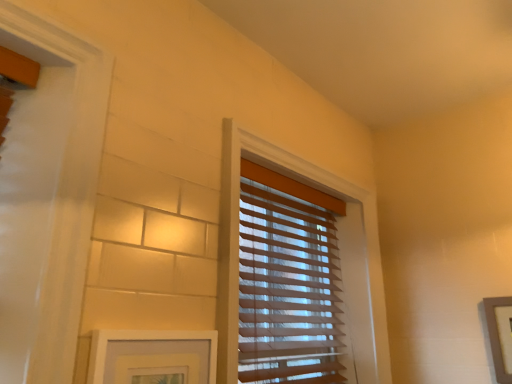
Question: Considering the relative sizes of wooden picture frame at right, which is counted as the second picture frame, starting from the left, and white matte picture frame at lower left, the 2th picture frame when ordered from back to front, in the image provided, is wooden picture frame at right, which is counted as the second picture frame, starting from the left, smaller than white matte picture frame at lower left, the 2th picture frame when ordered from back to front,?

Choices:
 (A) yes
 (B) no

Answer: (A)

Question: Is wooden picture frame at right, placed as the first picture frame when sorted from right to left, further to camera compared to white matte picture frame at lower left, the 2th picture frame viewed from the right?

Choices:
 (A) yes
 (B) no

Answer: (A)

Question: Can you confirm if wooden picture frame at right, placed as the first picture frame when sorted from right to left, is thinner than white matte picture frame at lower left, the first picture frame viewed from the front?

Choices:
 (A) yes
 (B) no

Answer: (A)

Question: Is wooden picture frame at right, which is counted as the second picture frame, starting from the left, outside of white matte picture frame at lower left, the 2th picture frame when ordered from back to front?

Choices:
 (A) no
 (B) yes

Answer: (B)

Question: Can you confirm if wooden picture frame at right, which is the 2th picture frame in front-to-back order, is bigger than white matte picture frame at lower left, the 2th picture frame when ordered from back to front?

Choices:
 (A) no
 (B) yes

Answer: (A)

Question: Would you say white matte picture frame at lower left, the first picture frame viewed from the front, is to the left or to the right of wooden picture frame at right, which is counted as the first picture frame, starting from the back, in the picture?

Choices:
 (A) right
 (B) left

Answer: (B)

Question: Choose the correct answer: Is white matte picture frame at lower left, which appears as the 1th picture frame when viewed from the left, inside wooden picture frame at right, placed as the first picture frame when sorted from right to left, or outside it?

Choices:
 (A) outside
 (B) inside

Answer: (A)

Question: From a real-world perspective, relative to wooden picture frame at right, which is counted as the second picture frame, starting from the left, is white matte picture frame at lower left, the first picture frame viewed from the front, vertically above or below?

Choices:
 (A) above
 (B) below

Answer: (B)

Question: Considering their positions, is white matte picture frame at lower left, the first picture frame viewed from the front, located in front of or behind wooden picture frame at right, which is counted as the first picture frame, starting from the back?

Choices:
 (A) behind
 (B) front

Answer: (B)

Question: Based on their positions, is translucent wood blinds at center located to the left or right of wooden picture frame at right, which is counted as the first picture frame, starting from the back?

Choices:
 (A) left
 (B) right

Answer: (A)

Question: Is point (335, 367) closer or farther from the camera than point (494, 344)?

Choices:
 (A) closer
 (B) farther

Answer: (B)

Question: Is translucent wood blinds at center bigger or smaller than wooden picture frame at right, which is counted as the first picture frame, starting from the back?

Choices:
 (A) big
 (B) small

Answer: (A)

Question: In terms of height, does translucent wood blinds at center look taller or shorter compared to wooden picture frame at right, which is the 2th picture frame in front-to-back order?

Choices:
 (A) tall
 (B) short

Answer: (A)

Question: From a real-world perspective, is white matte picture frame at lower left, the first picture frame viewed from the front, above or below translucent wood blinds at center?

Choices:
 (A) above
 (B) below

Answer: (B)

Question: Does point (112, 334) appear closer or farther from the camera than point (314, 331)?

Choices:
 (A) farther
 (B) closer

Answer: (B)